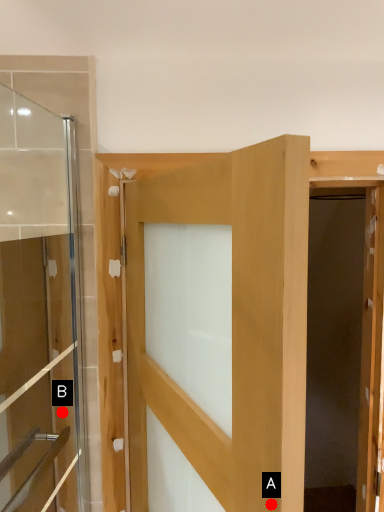
Question: Two points are circled on the image, labeled by A and B beside each circle. Which point appears closest to the camera in this image?

Choices:
 (A) A is closer
 (B) B is closer

Answer: (A)